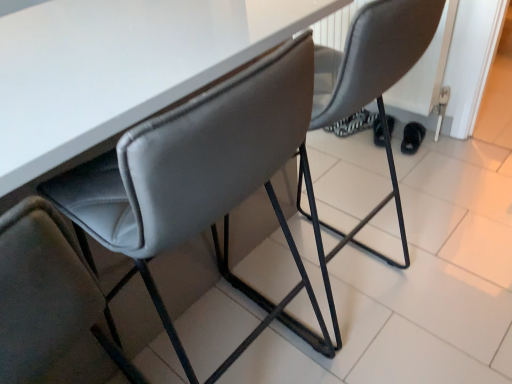
This screenshot has width=512, height=384. In order to click on blank space situated above suede-like gray chair at center, which ranks as the 2th chair in right-to-left order (from a real-world perspective) in this screenshot , I will do `click(80, 39)`.